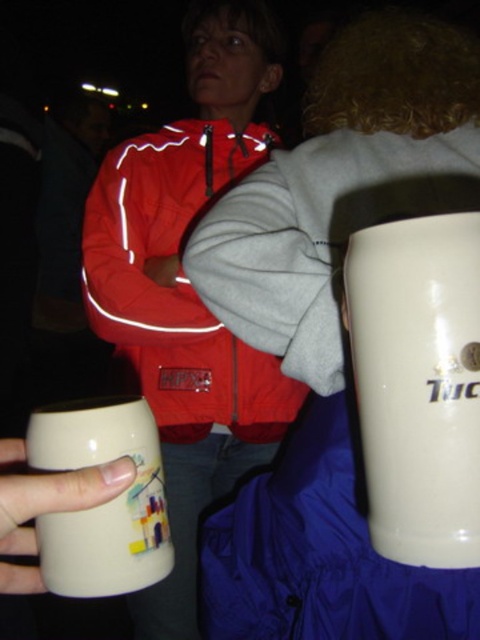
Question: Is the position of white glossy mug at right more distant than that of reflective red jacket at center?

Choices:
 (A) no
 (B) yes

Answer: (A)

Question: From the image, what is the correct spatial relationship of white glossy mug at right in relation to matte ceramic mug at lower left?

Choices:
 (A) left
 (B) right

Answer: (B)

Question: Which of the following is the farthest from the observer?

Choices:
 (A) matte ceramic mug at lower left
 (B) reflective red jacket at center

Answer: (B)

Question: Which of these objects is positioned closest to the reflective red jacket at center?

Choices:
 (A) matte ceramic mug at lower left
 (B) white glossy mug at right

Answer: (A)

Question: Considering the real-world distances, which object is farthest from the reflective red jacket at center?

Choices:
 (A) matte ceramic mug at lower left
 (B) white glossy mug at right

Answer: (B)

Question: Does white glossy mug at right lie behind reflective red jacket at center?

Choices:
 (A) yes
 (B) no

Answer: (B)